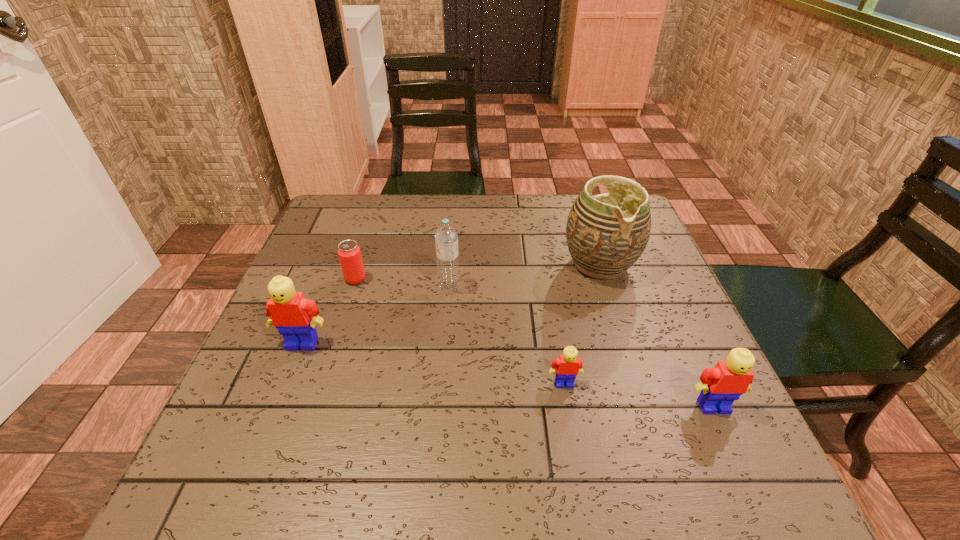
Select which Lego appears as the second closest to the nearest Lego. Please provide its 2D coordinates. Your answer should be formatted as a tuple, i.e. [(x, y)], where the tuple contains the x and y coordinates of a point satisfying the conditions above.

[(295, 317)]